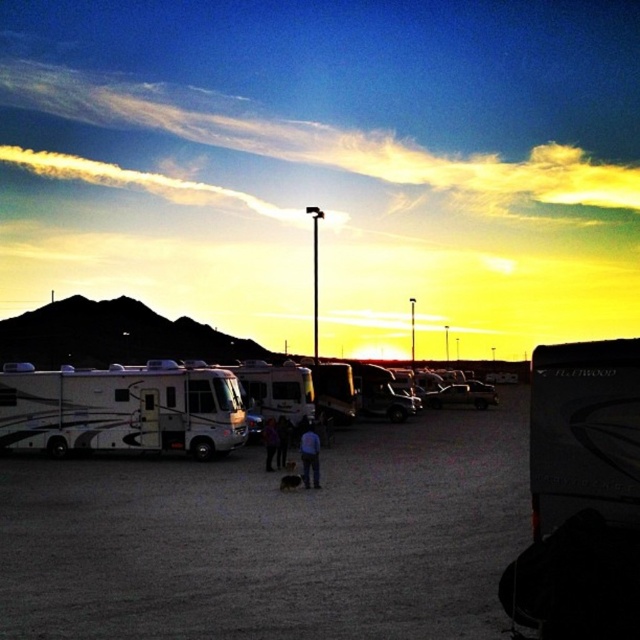
Consider the image. Which of these two, white glossy recreational vehicle at left or white glossy rv at center, stands shorter?

Standing shorter between the two is white glossy rv at center.

What do you see at coordinates (122, 410) in the screenshot? Image resolution: width=640 pixels, height=640 pixels. I see `white glossy recreational vehicle at left` at bounding box center [122, 410].

Where is `white glossy recreational vehicle at left`? This screenshot has width=640, height=640. white glossy recreational vehicle at left is located at coordinates pos(122,410).

Is point (74, 467) less distant than point (291, 385)?

That is True.

Where is `white glossy rv at left`? white glossy rv at left is located at coordinates (273, 538).

Measure the distance between point (259,561) and camera.

Point (259,561) and camera are 10.80 meters apart from each other.

This screenshot has width=640, height=640. I want to click on white glossy rv at left, so click(273, 538).

Can you confirm if white glossy recreational vehicle at left is bigger than dark blue jeans at center?

Indeed, white glossy recreational vehicle at left has a larger size compared to dark blue jeans at center.

Based on the photo, does white glossy recreational vehicle at left have a smaller size compared to dark blue jeans at center?

No, white glossy recreational vehicle at left is not smaller than dark blue jeans at center.

Find the location of a particular element. The height and width of the screenshot is (640, 640). white glossy recreational vehicle at left is located at coordinates (122, 410).

What are the coordinates of `white glossy recreational vehicle at left` in the screenshot? It's located at (122, 410).